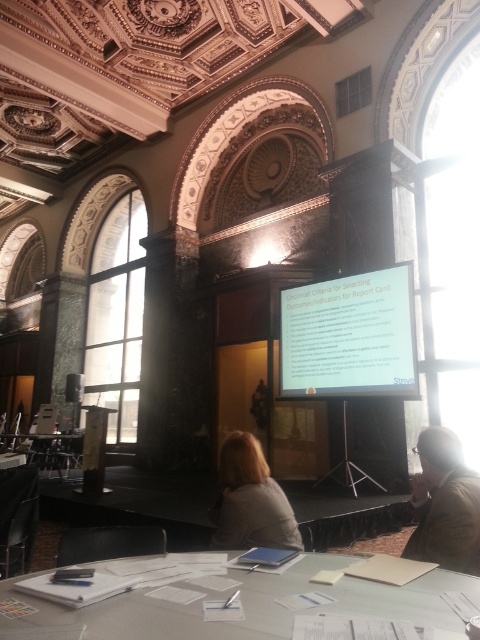
From the picture: Is white matte projector screen at center further to the viewer compared to brown leather jacket at lower right?

Yes, it is behind brown leather jacket at lower right.

Who is positioned more to the left, white matte projector screen at center or brown leather jacket at lower right?

brown leather jacket at lower right is more to the left.

Find the location of a particular element. The image size is (480, 640). white matte projector screen at center is located at coordinates point(349,337).

Does white glossy table at center appear on the left side of white matte projector screen at center?

Correct, you'll find white glossy table at center to the left of white matte projector screen at center.

Does white glossy table at center have a greater width compared to white matte projector screen at center?

Yes, white glossy table at center is wider than white matte projector screen at center.

Who is more distant from viewer, [3,589] or [299,340]?

The point [299,340] is more distant.

Find the location of a particular element. The image size is (480, 640). white glossy table at center is located at coordinates (254, 605).

Can you confirm if white glossy table at center is positioned above gray fabric jacket at center?

Yes.

The width and height of the screenshot is (480, 640). Describe the element at coordinates (254, 605) in the screenshot. I see `white glossy table at center` at that location.

The width and height of the screenshot is (480, 640). Find the location of `white glossy table at center`. white glossy table at center is located at coordinates (254, 605).